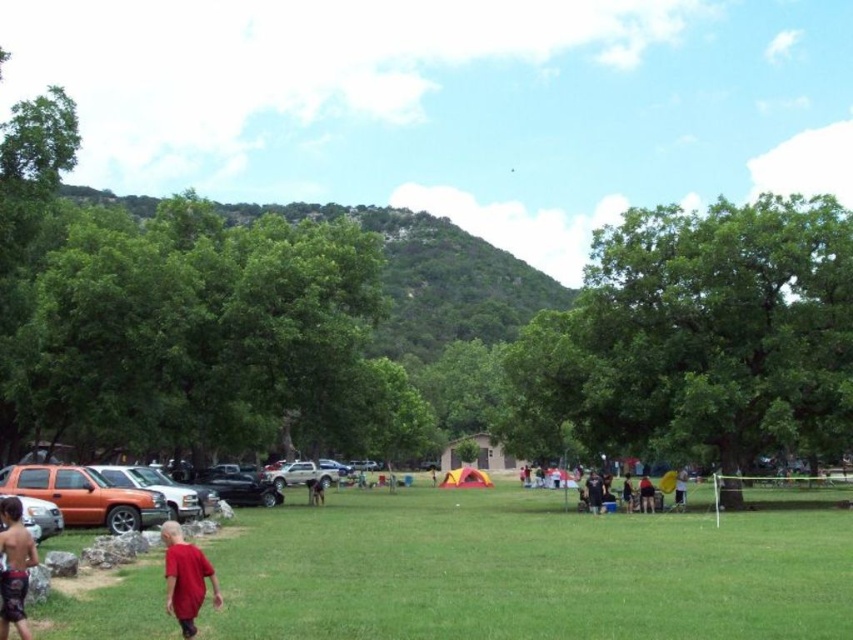
Question: Which is nearer to the shiny orange shorts at lower left?

Choices:
 (A) green grassy field at center
 (B) orange matte suv at lower left

Answer: (B)

Question: Can you confirm if green grassy field at center is positioned to the left of orange matte suv at lower left?

Choices:
 (A) no
 (B) yes

Answer: (A)

Question: Can you confirm if green grassy field at center is smaller than matte red shirt at lower left?

Choices:
 (A) yes
 (B) no

Answer: (B)

Question: Among these objects, which one is farthest from the camera?

Choices:
 (A) orange matte suv at lower left
 (B) matte red shirt at lower left
 (C) green grassy field at center
 (D) shiny orange shorts at lower left

Answer: (A)

Question: Is orange matte suv at lower left further to camera compared to matte red shirt at lower left?

Choices:
 (A) no
 (B) yes

Answer: (B)

Question: Among these points, which one is nearest to the camera?

Choices:
 (A) (96, 481)
 (B) (183, 600)
 (C) (531, 608)
 (D) (3, 573)

Answer: (D)